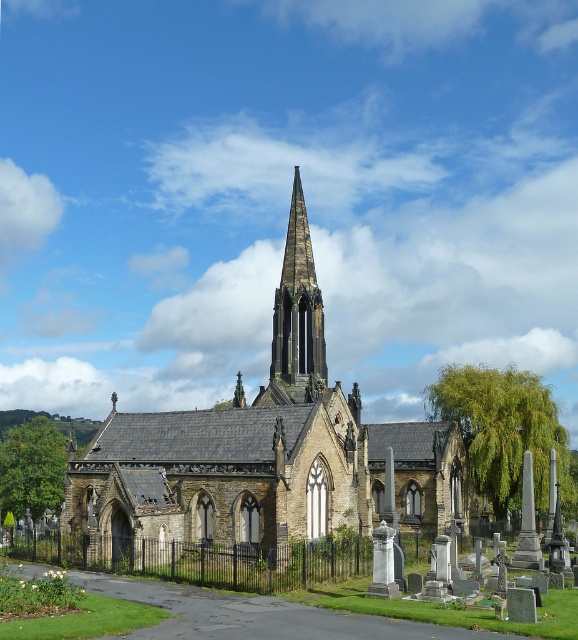
Is brown stone church at center shorter than smooth stone spire at center?

Incorrect, brown stone church at center's height does not fall short of smooth stone spire at center's.

Between point (116, 451) and point (279, 378), which one is positioned in front?

Point (116, 451) is in front.

What do you see at coordinates (265, 449) in the screenshot? This screenshot has height=640, width=578. I see `brown stone church at center` at bounding box center [265, 449].

The image size is (578, 640). What are the coordinates of `brown stone church at center` in the screenshot? It's located at (265, 449).